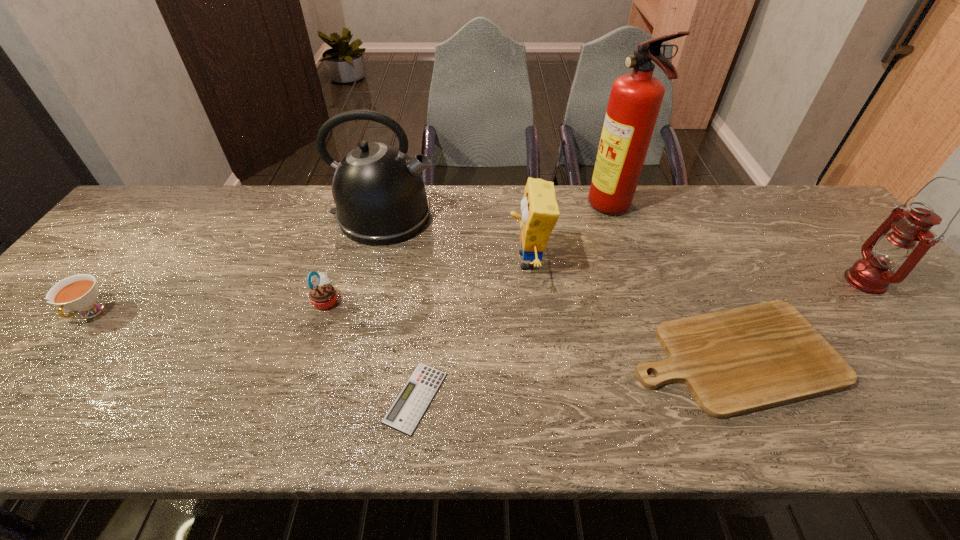
Where is `vacant space located 0.070m on the back of the chopping board`? The height and width of the screenshot is (540, 960). vacant space located 0.070m on the back of the chopping board is located at coordinates (700, 285).

Where is `vacant space situated 0.120m on the right of the calculator`? Image resolution: width=960 pixels, height=540 pixels. vacant space situated 0.120m on the right of the calculator is located at coordinates (504, 397).

I want to click on fire extinguisher present at the far edge, so click(x=635, y=99).

Locate an element on the screen. kettle located at the far edge is located at coordinates click(379, 192).

This screenshot has height=540, width=960. Identify the location of sponge situated at the far edge. (539, 209).

Locate an element on the screen. chopping board located in the near edge section of the desktop is located at coordinates (735, 361).

Identify the location of calculator present at the near edge. (405, 413).

At what (x,y) coordinates should I click in order to perform the action: click on object at the left edge. Please return your answer as a coordinate pair (x, y). The image size is (960, 540). Looking at the image, I should click on (79, 292).

Find the location of a particular element. The image size is (960, 540). object located in the right edge section of the desktop is located at coordinates pyautogui.click(x=872, y=274).

You are a GUI agent. You are given a task and a screenshot of the screen. Output one action in this format:
    pyautogui.click(x=<x>, y=<y>)
    Task: Click on the vacant space at the far edge
    
    Given the screenshot: What is the action you would take?
    pyautogui.click(x=559, y=187)